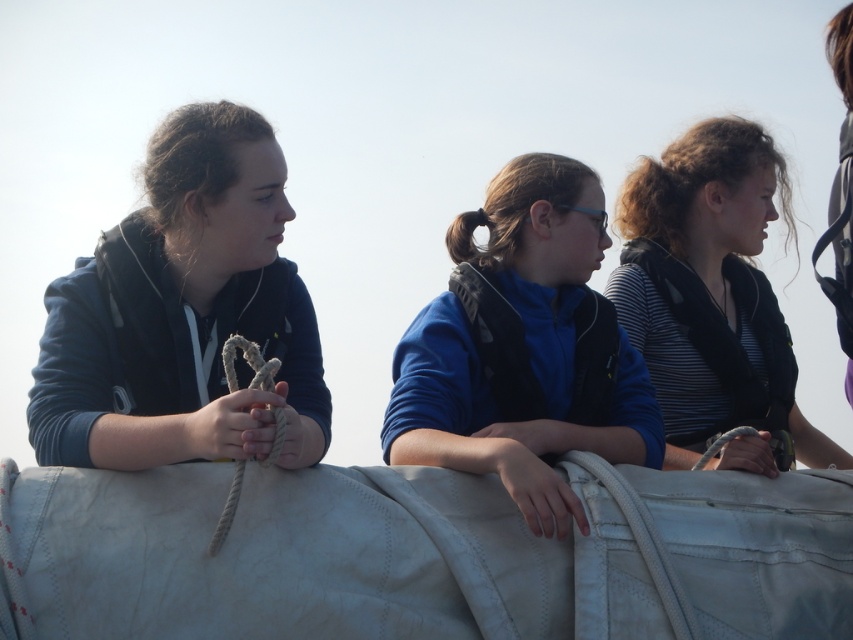
Question: Where is matte blue hoodie at left located in relation to blue fleece jacket at center in the image?

Choices:
 (A) below
 (B) above

Answer: (B)

Question: Which object is positioned farthest from the striped fabric shirt at center?

Choices:
 (A) blue fleece jacket at center
 (B) matte blue hoodie at left

Answer: (B)

Question: Which object appears farthest from the camera in this image?

Choices:
 (A) matte blue hoodie at left
 (B) striped fabric shirt at center

Answer: (B)

Question: Which object is farther from the camera taking this photo?

Choices:
 (A) blue fleece jacket at center
 (B) matte blue hoodie at left

Answer: (A)

Question: Does matte blue hoodie at left have a smaller size compared to blue fleece jacket at center?

Choices:
 (A) no
 (B) yes

Answer: (B)

Question: From the image, what is the correct spatial relationship of matte blue hoodie at left in relation to blue fleece jacket at center?

Choices:
 (A) above
 (B) below

Answer: (A)